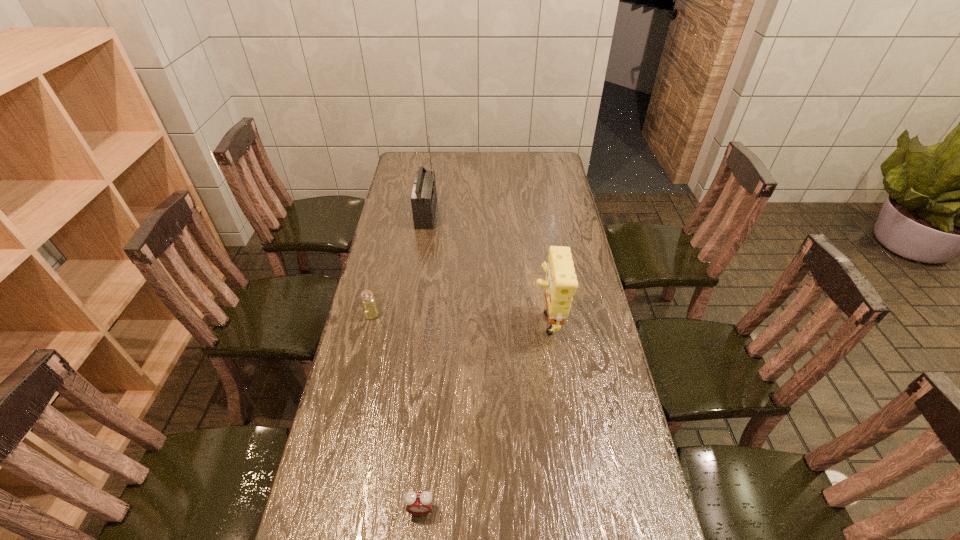
Where is `free space between the leftmost object and the radio receiver`? free space between the leftmost object and the radio receiver is located at coordinates (399, 265).

The image size is (960, 540). In order to click on free space between the nearest object and the leftmost object in this screenshot , I will do `click(396, 412)`.

At what (x,y) coordinates should I click in order to perform the action: click on unoccupied position between the alarm clock and the saltshaker. Please return your answer as a coordinate pair (x, y). The height and width of the screenshot is (540, 960). Looking at the image, I should click on (396, 412).

The width and height of the screenshot is (960, 540). Identify the location of empty space that is in between the leftmost object and the alarm clock. (396, 412).

Where is `free space between the third object from left to right and the radio receiver`? The height and width of the screenshot is (540, 960). free space between the third object from left to right and the radio receiver is located at coordinates point(423,362).

Where is `vacant space in between the rightmost object and the third object from right to left`? The width and height of the screenshot is (960, 540). vacant space in between the rightmost object and the third object from right to left is located at coordinates (487, 266).

Find the location of a particular element. This screenshot has height=540, width=960. vacant space that's between the leftmost object and the second object from left to right is located at coordinates coord(399,265).

You are a GUI agent. You are given a task and a screenshot of the screen. Output one action in this format:
    pyautogui.click(x=<x>, y=<y>)
    Task: Click on the unoccupied area between the nearest object and the saltshaker
    This screenshot has height=540, width=960.
    Given the screenshot: What is the action you would take?
    pyautogui.click(x=396, y=412)

Identify the location of unoccupied position between the alarm clock and the saltshaker. The height and width of the screenshot is (540, 960). (396, 412).

Locate an element on the screen. object that is the closest to the rightmost object is located at coordinates (370, 309).